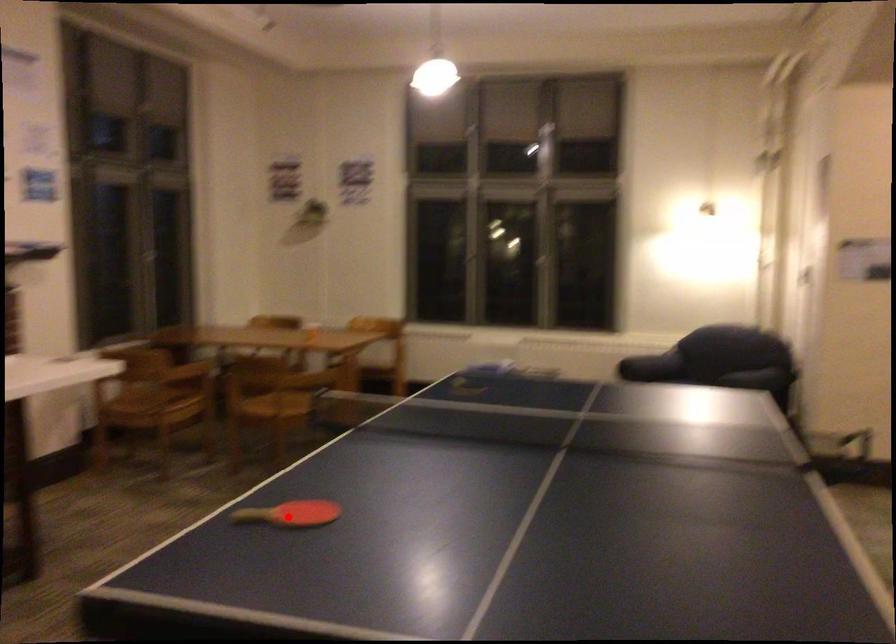
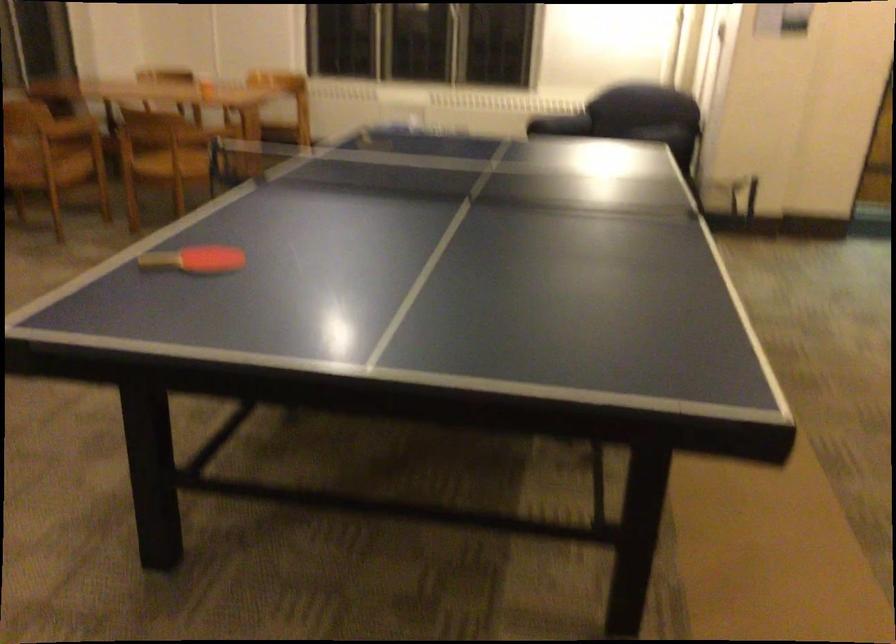
The point at the highlighted location is marked in the first image. Where is the corresponding point in the second image?

(194, 259)